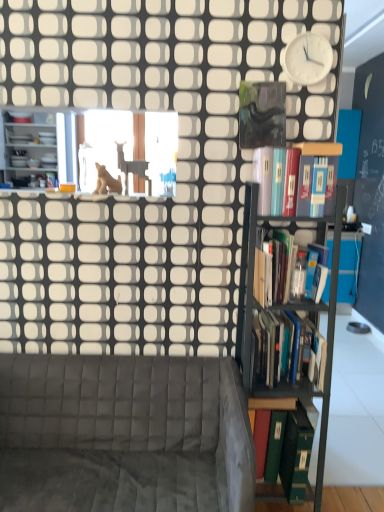
At what (x,y) coordinates should I click in order to perform the action: click on black metal bookshelf at right. Please return your answer as a coordinate pair (x, y). Looking at the image, I should click on tap(289, 310).

Measure the distance between white plastic clock at upper right and camera.

white plastic clock at upper right and camera are 1.69 meters apart from each other.

Describe the element at coordinates (288, 267) in the screenshot. I see `hardcover books at right, the 3th book when ordered from bottom to top` at that location.

What is the approximate height of hardcover books at right, positioned as the second book in bottom-to-top order?

hardcover books at right, positioned as the second book in bottom-to-top order, is 26.68 centimeters tall.

The image size is (384, 512). What are the coordinates of `matte beige cat at upper center` in the screenshot? It's located at (106, 181).

Describe the element at coordinates (299, 179) in the screenshot. The height and width of the screenshot is (512, 384). I see `hardcover book at upper right, acting as the fourth book starting from the bottom` at that location.

Identify the location of black metal bookshelf at right. (289, 310).

Is hardcover books at right, marked as the second book in a top-to-bottom arrangement, aimed at hardcover books at right, positioned as the second book in bottom-to-top order?

No, hardcover books at right, marked as the second book in a top-to-bottom arrangement, is not aimed at hardcover books at right, positioned as the second book in bottom-to-top order.

Which point is more distant from viewer, (286, 288) or (283, 384)?

Point (283, 384)

You are a GUI agent. You are given a task and a screenshot of the screen. Output one action in this format:
    pyautogui.click(x=<x>, y=<y>)
    Task: Click on the 2nd book behind the hardcover books at right, marked as the second book in a top-to-bottom arrangement, starting your count from the anchor
    This screenshot has height=512, width=384.
    Given the screenshot: What is the action you would take?
    pyautogui.click(x=304, y=350)

Considering the relative sizes of hardcover books at right, the 3th book when ordered from bottom to top, and hardcover books at right, which is the 3th book in top-to-bottom order, in the image provided, is hardcover books at right, the 3th book when ordered from bottom to top, thinner than hardcover books at right, which is the 3th book in top-to-bottom order,?

Yes, hardcover books at right, the 3th book when ordered from bottom to top, is thinner than hardcover books at right, which is the 3th book in top-to-bottom order.

Consider the image. Which is more to the left, hardcover books at right, the 3th book when ordered from bottom to top, or velvet grey couch at lower left?

velvet grey couch at lower left is more to the left.

Locate an element on the screen. Image resolution: width=384 pixels, height=512 pixels. book that is the 4th one when counting rightward from the velvet grey couch at lower left is located at coordinates (288, 267).

How different are the orientations of hardcover books at right, the 3th book when ordered from bottom to top, and velvet grey couch at lower left in degrees?

They differ by 0.626 degrees in their facing directions.

From the image's perspective, relative to hardcover book at upper right, acting as the fourth book starting from the bottom, is white plastic clock at upper right above or below?

Clearly, from the image's perspective, white plastic clock at upper right is above hardcover book at upper right, acting as the fourth book starting from the bottom.

The width and height of the screenshot is (384, 512). Find the location of `book that is the 2nd object to the left of the white plastic clock at upper right, starting at the anchor`. book that is the 2nd object to the left of the white plastic clock at upper right, starting at the anchor is located at coordinates (299, 179).

Which is behind, point (324, 73) or point (303, 191)?

Positioned behind is point (324, 73).

Can you tell me how much white plastic clock at upper right and hardcover book at upper right, acting as the fourth book starting from the bottom, differ in facing direction?

0.106 degrees.

Does matte white shelves at left have a larger size compared to white plastic clock at upper right?

Yes.

Is point (23, 158) closer to viewer compared to point (307, 75)?

That is False.

How different are the orientations of matte white shelves at left and white plastic clock at upper right in degrees?

They differ by 1.69 degrees in their facing directions.

From the image's perspective, is matte white shelves at left located above or below white plastic clock at upper right?

matte white shelves at left is above white plastic clock at upper right.

From the image's perspective, count 3rd books downward from the hardcover book at upper right, acting as the fourth book starting from the bottom, and point to it. Please provide its 2D coordinates.

[(297, 452)]

Considering the sizes of objects hardcover book at upper right, positioned as the first book in top-to-bottom order, and green matte book at right, the fourth book positioned from the top, in the image provided, who is shorter, hardcover book at upper right, positioned as the first book in top-to-bottom order, or green matte book at right, the fourth book positioned from the top,?

Standing shorter between the two is hardcover book at upper right, positioned as the first book in top-to-bottom order.

Is hardcover book at upper right, acting as the fourth book starting from the bottom, located outside green matte book at right, the 1th book in the bottom-to-top sequence?

Yes.

How many degrees apart are the facing directions of hardcover book at upper right, acting as the fourth book starting from the bottom, and green matte book at right, the 1th book in the bottom-to-top sequence?

0.000105 degrees separate the facing orientations of hardcover book at upper right, acting as the fourth book starting from the bottom, and green matte book at right, the 1th book in the bottom-to-top sequence.

Is black metal bookshelf at right not near white plastic clock at upper right?

black metal bookshelf at right is near white plastic clock at upper right, not far away.

Which object is positioned more to the left, black metal bookshelf at right or white plastic clock at upper right?

From the viewer's perspective, black metal bookshelf at right appears more on the left side.

Is black metal bookshelf at right taller or shorter than white plastic clock at upper right?

In the image, black metal bookshelf at right appears to be taller than white plastic clock at upper right.

Does velvet grey couch at lower left have a larger size compared to matte beige cat at upper center?

Yes, velvet grey couch at lower left is bigger than matte beige cat at upper center.

Is velvet grey couch at lower left at the right side of matte beige cat at upper center?

Indeed, velvet grey couch at lower left is positioned on the right side of matte beige cat at upper center.

From a real-world perspective, is velvet grey couch at lower left over matte beige cat at upper center?

No, from a real-world perspective, velvet grey couch at lower left is not over matte beige cat at upper center

Are velvet grey couch at lower left and matte beige cat at upper center far apart?

Yes, velvet grey couch at lower left and matte beige cat at upper center are quite far apart.

Find the location of a particular element. This screenshot has width=384, height=512. the 1st book below the hardcover books at right, marked as the second book in a top-to-bottom arrangement (from the image's perspective) is located at coordinates point(304,350).

In order to click on book that is the 1st object located behind the velvet grey couch at lower left in this screenshot , I will do `click(288, 267)`.

Which object lies nearer to the anchor point hardcover books at right, positioned as the second book in bottom-to-top order, hardcover book at upper right, positioned as the first book in top-to-bottom order, or velvet grey couch at lower left?

velvet grey couch at lower left.

Looking at the image, which one is located closer to matte white shelves at left, matte beige cat at upper center or hardcover books at right, positioned as the second book in bottom-to-top order?

matte beige cat at upper center is closer to matte white shelves at left.

Estimate the real-world distances between objects in this image. Which object is further from green matte book at right, the fourth book positioned from the top, hardcover book at upper right, positioned as the first book in top-to-bottom order, or velvet grey couch at lower left?

Among the two, hardcover book at upper right, positioned as the first book in top-to-bottom order, is located further to green matte book at right, the fourth book positioned from the top.

Looking at the image, which one is located further to hardcover book at upper right, positioned as the first book in top-to-bottom order, black metal bookshelf at right or matte white shelves at left?

matte white shelves at left lies further to hardcover book at upper right, positioned as the first book in top-to-bottom order, than the other object.

Looking at the image, which one is located closer to matte white shelves at left, black metal bookshelf at right or hardcover book at upper right, acting as the fourth book starting from the bottom?

hardcover book at upper right, acting as the fourth book starting from the bottom.

Which object lies further to the anchor point matte beige cat at upper center, hardcover books at right, the 3th book when ordered from bottom to top, or hardcover book at upper right, acting as the fourth book starting from the bottom?

hardcover books at right, the 3th book when ordered from bottom to top, is positioned further to the anchor matte beige cat at upper center.

Looking at the image, which one is located further to velvet grey couch at lower left, matte white shelves at left or green matte book at right, the fourth book positioned from the top?

matte white shelves at left is positioned further to the anchor velvet grey couch at lower left.

From the image, which object appears to be nearer to matte white shelves at left, matte beige cat at upper center or black metal bookshelf at right?

Based on the image, matte beige cat at upper center appears to be nearer to matte white shelves at left.

Where is `shelf between hardcover books at right, which is the 3th book in top-to-bottom order, and green matte book at right, the 1th book in the bottom-to-top sequence, from top to bottom`? shelf between hardcover books at right, which is the 3th book in top-to-bottom order, and green matte book at right, the 1th book in the bottom-to-top sequence, from top to bottom is located at coordinates (289, 310).

What are the coordinates of `animal between white plastic clock at upper right and velvet grey couch at lower left from top to bottom` in the screenshot? It's located at (106, 181).

Where is `animal between black metal bookshelf at right and matte white shelves at left from front to back`? Image resolution: width=384 pixels, height=512 pixels. animal between black metal bookshelf at right and matte white shelves at left from front to back is located at coordinates (106, 181).

Where is `animal between white plastic clock at upper right and hardcover books at right, which is the 3th book in top-to-bottom order, in the up-down direction`? animal between white plastic clock at upper right and hardcover books at right, which is the 3th book in top-to-bottom order, in the up-down direction is located at coordinates (106, 181).